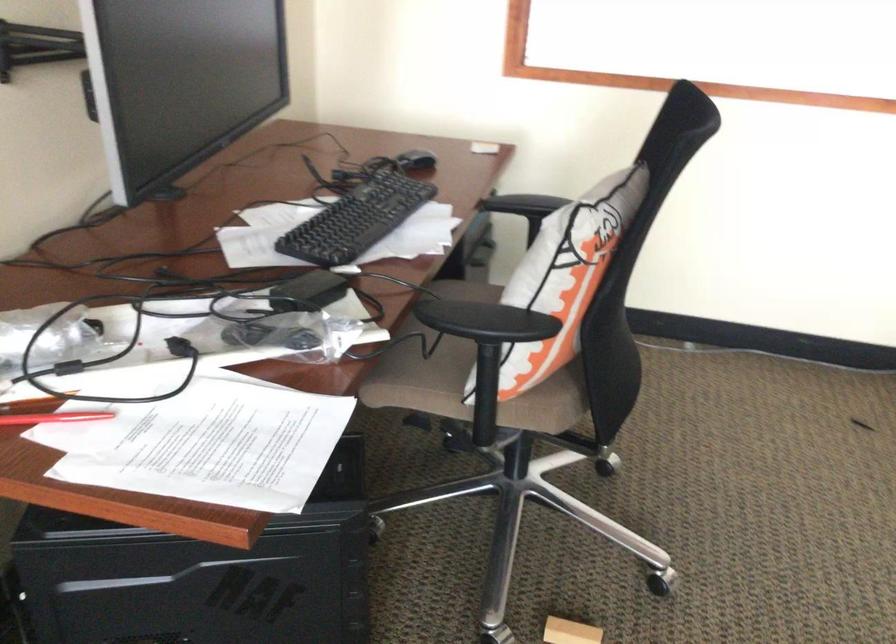
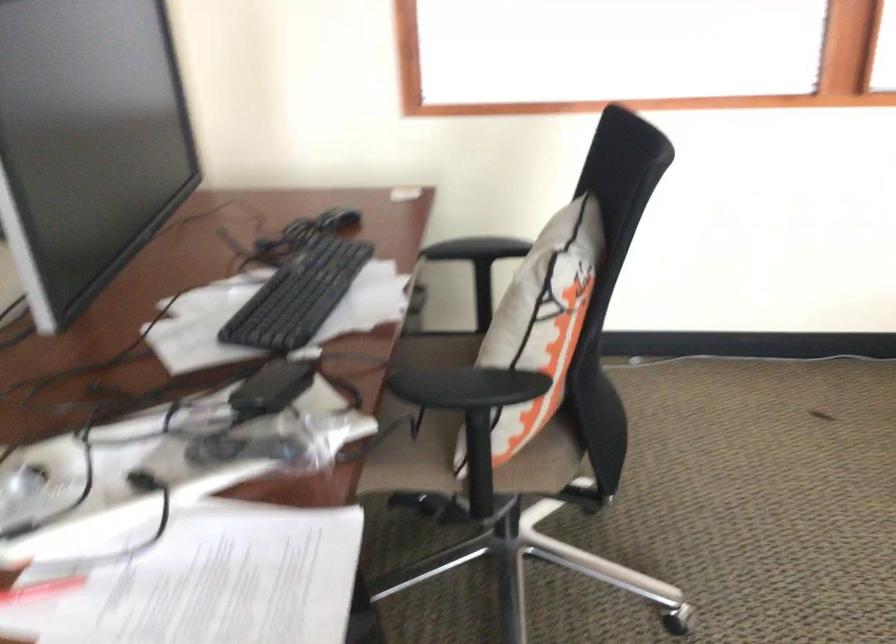
What movement of the cameraman would produce the second image?

The cameraman moved toward left, forward.